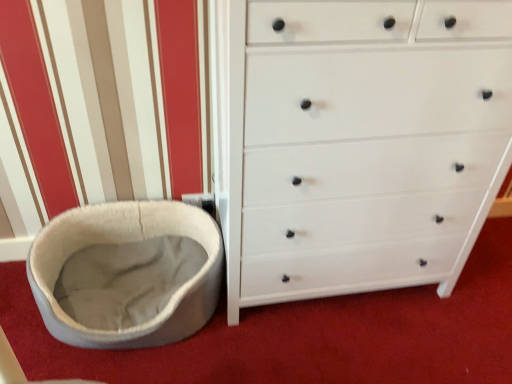
The image size is (512, 384). What are the coordinates of `soft gray fabric cat bed at left` in the screenshot? It's located at (120, 241).

The image size is (512, 384). What do you see at coordinates (120, 241) in the screenshot?
I see `soft gray fabric cat bed at left` at bounding box center [120, 241].

At what (x,y) coordinates should I click in order to perform the action: click on soft gray fabric cat bed at left. Please return your answer as a coordinate pair (x, y). The image size is (512, 384). Looking at the image, I should click on (120, 241).